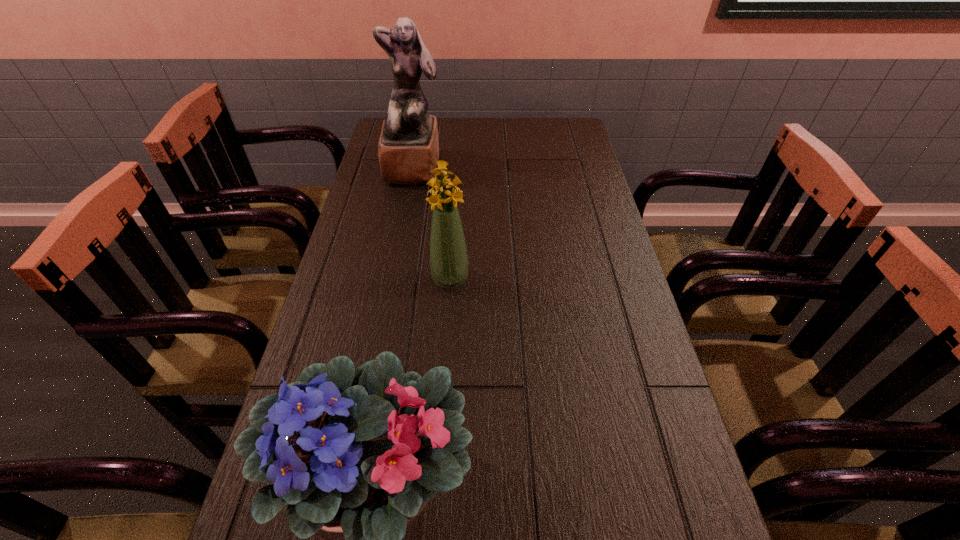
At what (x,y) coordinates should I click in order to perform the action: click on the farthest object. Please return your answer as a coordinate pair (x, y). Looking at the image, I should click on (408, 149).

Where is `the tallest object`? the tallest object is located at coordinates (408, 149).

Locate an element on the screen. This screenshot has height=540, width=960. the taller bouquet is located at coordinates (448, 255).

Find the location of a particular element. The image size is (960, 540). the second farthest object is located at coordinates (448, 255).

What are the coordinates of `vacant space situated in a relaxed pose on the sculpture` in the screenshot? It's located at (401, 234).

This screenshot has height=540, width=960. In order to click on free point located on the front-facing side of the taller bouquet in this screenshot , I will do `click(445, 358)`.

Where is `object that is at the far edge`? The image size is (960, 540). object that is at the far edge is located at coordinates (408, 149).

Find the location of a particular element. This screenshot has height=540, width=960. object at the left edge is located at coordinates (408, 149).

The width and height of the screenshot is (960, 540). In order to click on object located at the far left corner in this screenshot , I will do coord(408,149).

In the image, there is a desktop. In order to click on vacant space at the far edge in this screenshot , I will do `click(530, 132)`.